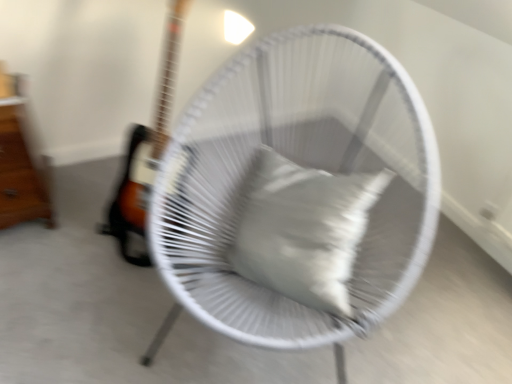
Question: Is white woven chair at center further to camera compared to wooden drawer at left?

Choices:
 (A) yes
 (B) no

Answer: (B)

Question: From the image's perspective, is white woven chair at center above wooden drawer at left?

Choices:
 (A) no
 (B) yes

Answer: (A)

Question: Would you say white woven chair at center is a long distance from wooden drawer at left?

Choices:
 (A) yes
 (B) no

Answer: (B)

Question: Is white woven chair at center oriented away from wooden drawer at left?

Choices:
 (A) no
 (B) yes

Answer: (A)

Question: Can you confirm if white woven chair at center is wider than wooden drawer at left?

Choices:
 (A) no
 (B) yes

Answer: (B)

Question: Relative to white woven chair at center, is white matte pillow at center in front or behind?

Choices:
 (A) behind
 (B) front

Answer: (A)

Question: Looking at the image, does white matte pillow at center seem bigger or smaller compared to white woven chair at center?

Choices:
 (A) big
 (B) small

Answer: (B)

Question: Considering the positions of white matte pillow at center and white woven chair at center in the image, is white matte pillow at center wider or thinner than white woven chair at center?

Choices:
 (A) wide
 (B) thin

Answer: (B)

Question: From the image's perspective, is white matte pillow at center located above or below white woven chair at center?

Choices:
 (A) below
 (B) above

Answer: (A)

Question: Considering the positions of point (402, 291) and point (338, 203), is point (402, 291) closer or farther from the camera than point (338, 203)?

Choices:
 (A) farther
 (B) closer

Answer: (B)

Question: Considering their positions, is white woven chair at center located in front of or behind white matte pillow at center?

Choices:
 (A) behind
 (B) front

Answer: (B)

Question: Considering the positions of white woven chair at center and white matte pillow at center in the image, is white woven chair at center wider or thinner than white matte pillow at center?

Choices:
 (A) wide
 (B) thin

Answer: (A)

Question: Is white woven chair at center to the left or to the right of white matte pillow at center in the image?

Choices:
 (A) left
 (B) right

Answer: (A)

Question: Is white woven chair at center inside or outside of wooden drawer at left?

Choices:
 (A) inside
 (B) outside

Answer: (B)

Question: Is point (429, 172) positioned closer to the camera than point (11, 198)?

Choices:
 (A) closer
 (B) farther

Answer: (A)